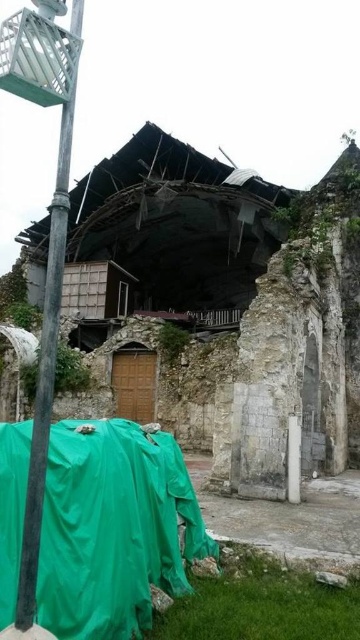
Between green tarpaulin at lower left and metallic pole at left, which one appears on the right side from the viewer's perspective?

green tarpaulin at lower left is more to the right.

Between point (101, 566) and point (33, 588), which one is positioned behind?

The point (101, 566) is more distant.

Between point (93, 627) and point (18, 621), which one is positioned behind?

The point (93, 627) is behind.

I want to click on green tarpaulin at lower left, so click(113, 529).